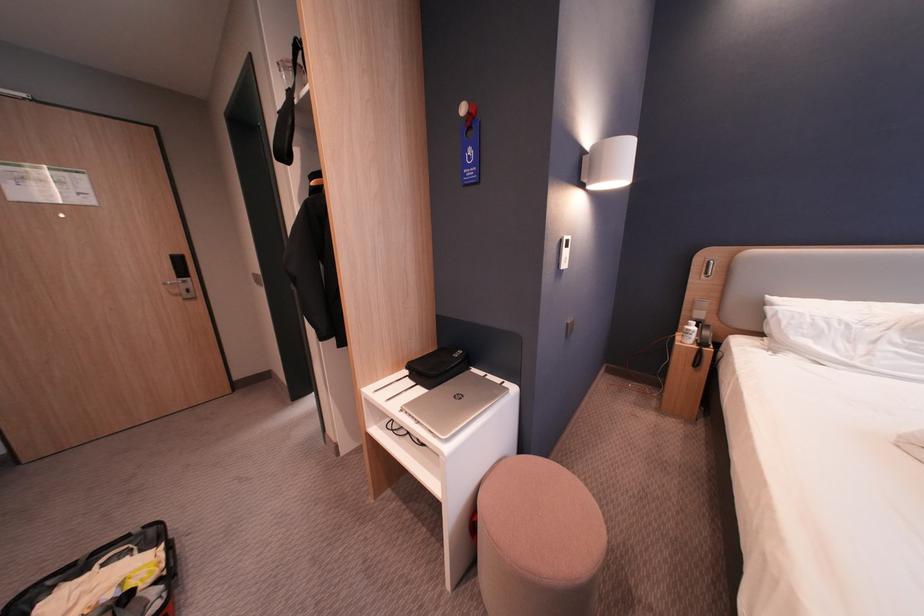
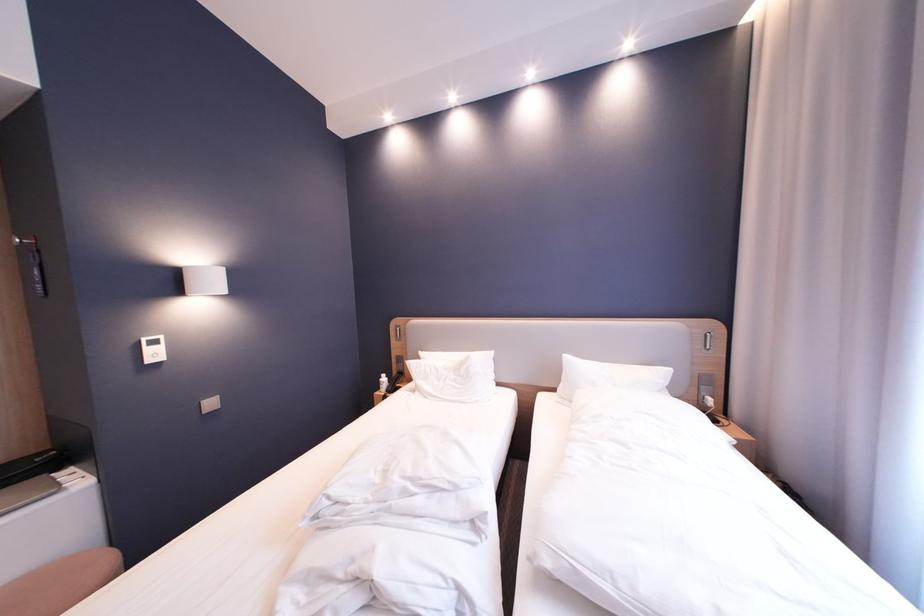
The images are taken continuously from a first-person perspective. In which direction are you moving?

The movement direction of the cameraman is right, backward.